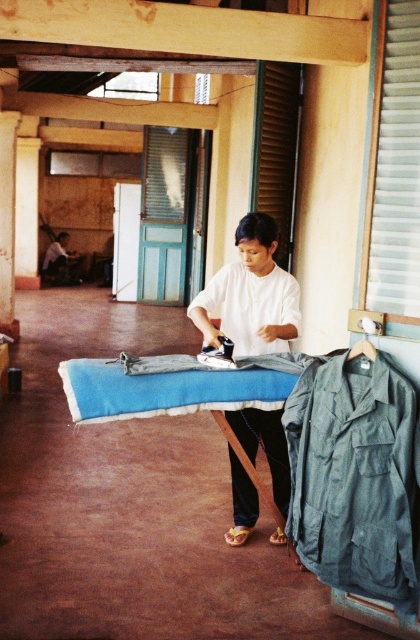
Is white matte shirt at center to the right of dark blue shirt at center from the viewer's perspective?

Correct, you'll find white matte shirt at center to the right of dark blue shirt at center.

What do you see at coordinates (249, 294) in the screenshot? I see `white matte shirt at center` at bounding box center [249, 294].

What do you see at coordinates (249, 294) in the screenshot?
I see `white matte shirt at center` at bounding box center [249, 294].

Find the location of `white matte shirt at center`. white matte shirt at center is located at coordinates (249, 294).